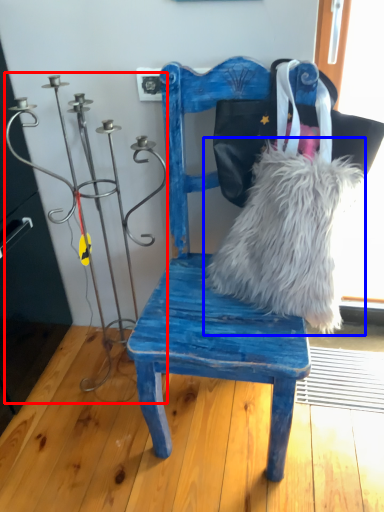
Question: Which of the following is the closest to the observer, candle holder (highlighted by a red box) or fur (highlighted by a blue box)?

Choices:
 (A) candle holder
 (B) fur

Answer: (A)